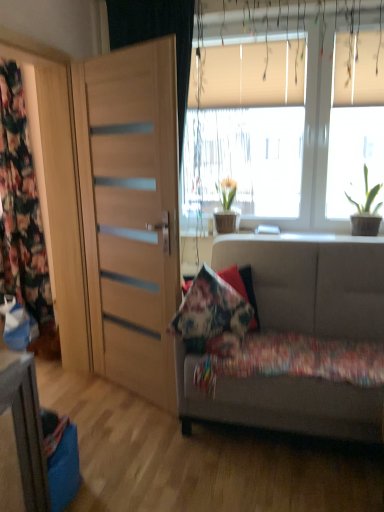
Question: Does floral fabric curtain at left have a lesser width compared to textured beige couch at lower right?

Choices:
 (A) yes
 (B) no

Answer: (A)

Question: Is floral fabric curtain at left positioned before textured beige couch at lower right?

Choices:
 (A) no
 (B) yes

Answer: (A)

Question: Does floral fabric curtain at left have a smaller size compared to textured beige couch at lower right?

Choices:
 (A) yes
 (B) no

Answer: (A)

Question: Is floral fabric curtain at left taller than textured beige couch at lower right?

Choices:
 (A) no
 (B) yes

Answer: (B)

Question: Is textured beige couch at lower right at the back of floral fabric curtain at left?

Choices:
 (A) no
 (B) yes

Answer: (A)

Question: In the image, is floral fabric cushion at lower right on the left side or the right side of textured beige couch at lower right?

Choices:
 (A) right
 (B) left

Answer: (B)

Question: Is floral fabric cushion at lower right in front of or behind textured beige couch at lower right in the image?

Choices:
 (A) behind
 (B) front

Answer: (A)

Question: Looking at the image, does floral fabric cushion at lower right seem bigger or smaller compared to textured beige couch at lower right?

Choices:
 (A) small
 (B) big

Answer: (A)

Question: From a real-world perspective, is floral fabric cushion at lower right above or below textured beige couch at lower right?

Choices:
 (A) above
 (B) below

Answer: (B)

Question: In terms of height, does green matte plant at upper right, which is counted as the 2th houseplant, starting from the left, look taller or shorter compared to white matte window at upper center?

Choices:
 (A) tall
 (B) short

Answer: (B)

Question: Is point (369, 201) closer or farther from the camera than point (201, 207)?

Choices:
 (A) closer
 (B) farther

Answer: (A)

Question: Is green matte plant at upper right, the 2th houseplant positioned from the back, inside the boundaries of white matte window at upper center, or outside?

Choices:
 (A) inside
 (B) outside

Answer: (B)

Question: Is green matte plant at upper right, positioned as the 1th houseplant in right-to-left order, wider or thinner than white matte window at upper center?

Choices:
 (A) wide
 (B) thin

Answer: (A)

Question: Relative to green matte plant at center, which is counted as the 2th houseplant, starting from the front, is floral fabric pillow at center in front or behind?

Choices:
 (A) behind
 (B) front

Answer: (B)

Question: From the image's perspective, relative to green matte plant at center, which is counted as the 2th houseplant, starting from the front, is floral fabric pillow at center above or below?

Choices:
 (A) below
 (B) above

Answer: (A)